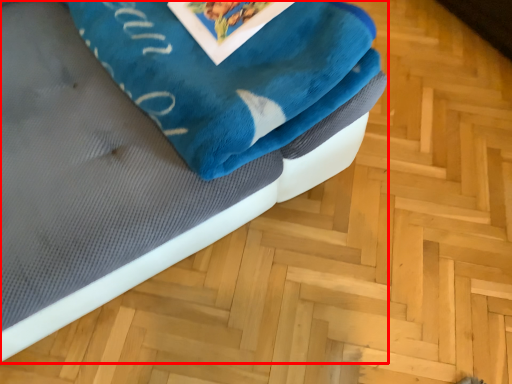
Question: From the image's perspective, what is the correct spatial positioning of furniture (annotated by the red box) in reference to bath towel?

Choices:
 (A) above
 (B) below

Answer: (B)